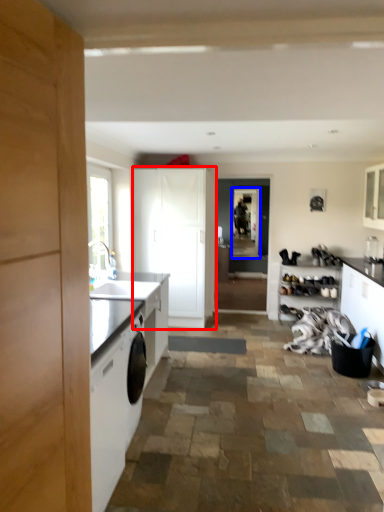
Question: Which object is closer to the camera taking this photo, cabinetry (highlighted by a red box) or screen door (highlighted by a blue box)?

Choices:
 (A) cabinetry
 (B) screen door

Answer: (A)